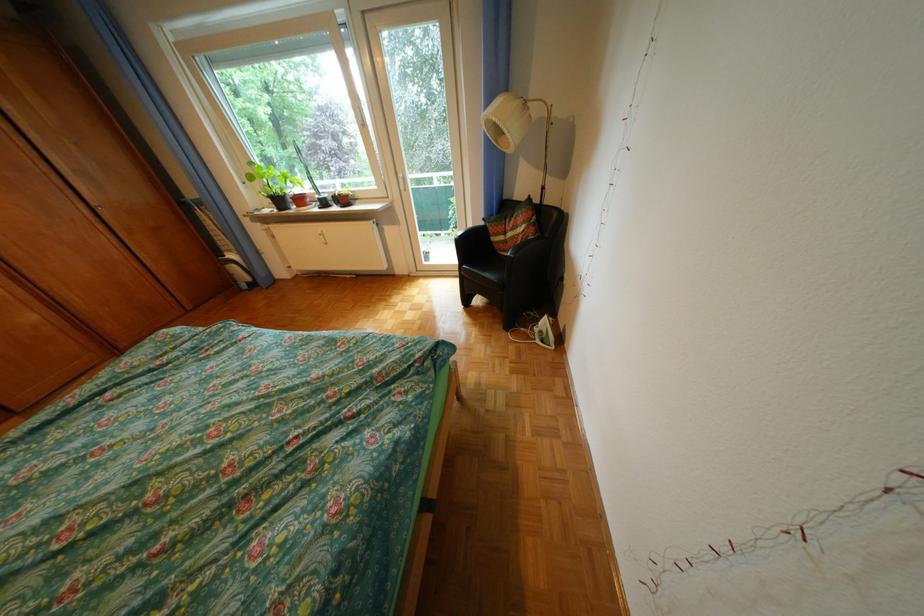
At what (x,y) coordinates should I click in order to perform the action: click on white window handle. Please return your answer as a coordinate pair (x, y). Image resolution: width=924 pixels, height=616 pixels. Looking at the image, I should click on (322, 238).